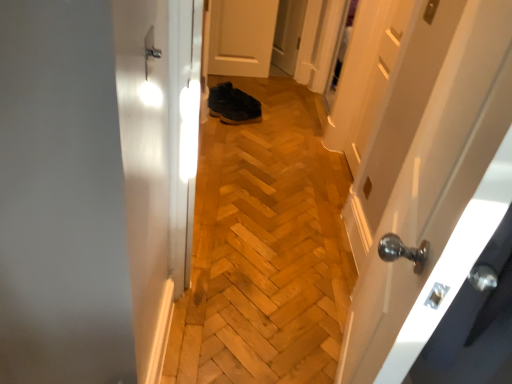
Question: Considering the relative sizes of satin nickel door handle at upper center and dark brown leather shoes at center in the image provided, is satin nickel door handle at upper center shorter than dark brown leather shoes at center?

Choices:
 (A) no
 (B) yes

Answer: (B)

Question: Does satin nickel door handle at upper center turn towards dark brown leather shoes at center?

Choices:
 (A) yes
 (B) no

Answer: (B)

Question: Is satin nickel door handle at upper center oriented away from dark brown leather shoes at center?

Choices:
 (A) yes
 (B) no

Answer: (B)

Question: Considering the relative sizes of satin nickel door handle at upper center and dark brown leather shoes at center in the image provided, is satin nickel door handle at upper center bigger than dark brown leather shoes at center?

Choices:
 (A) no
 (B) yes

Answer: (A)

Question: Can you confirm if satin nickel door handle at upper center is thinner than dark brown leather shoes at center?

Choices:
 (A) yes
 (B) no

Answer: (A)

Question: Which is correct: dark brown leather shoes at center is inside white matte door at center, marked as the 2th door in a bottom-to-top arrangement, or outside of it?

Choices:
 (A) outside
 (B) inside

Answer: (A)

Question: Considering their positions, is dark brown leather shoes at center located in front of or behind white matte door at center, placed as the 1th door when sorted from top to bottom?

Choices:
 (A) front
 (B) behind

Answer: (A)

Question: Visually, is dark brown leather shoes at center positioned to the left or to the right of white matte door at center, which is counted as the first door, starting from the back?

Choices:
 (A) left
 (B) right

Answer: (A)

Question: From the image's perspective, is dark brown leather shoes at center positioned above or below white matte door at center, arranged as the second door when viewed from the front?

Choices:
 (A) below
 (B) above

Answer: (A)

Question: Is white matte door at center, arranged as the second door when viewed from the front, bigger or smaller than wooden shoes at center?

Choices:
 (A) big
 (B) small

Answer: (B)

Question: Is white matte door at center, placed as the 1th door when sorted from top to bottom, spatially inside wooden shoes at center, or outside of it?

Choices:
 (A) outside
 (B) inside

Answer: (A)

Question: Considering their positions, is white matte door at center, which is counted as the first door, starting from the back, located in front of or behind wooden shoes at center?

Choices:
 (A) behind
 (B) front

Answer: (A)

Question: Considering the positions of white matte door at center, placed as the 1th door when sorted from top to bottom, and wooden shoes at center in the image, is white matte door at center, placed as the 1th door when sorted from top to bottom, taller or shorter than wooden shoes at center?

Choices:
 (A) tall
 (B) short

Answer: (A)

Question: From a real-world perspective, is white glossy door at right, which is the first door in bottom-to-top order, physically located above or below white matte door at center, marked as the 2th door in a bottom-to-top arrangement?

Choices:
 (A) below
 (B) above

Answer: (B)

Question: Does point (382, 127) appear closer or farther from the camera than point (275, 6)?

Choices:
 (A) closer
 (B) farther

Answer: (A)